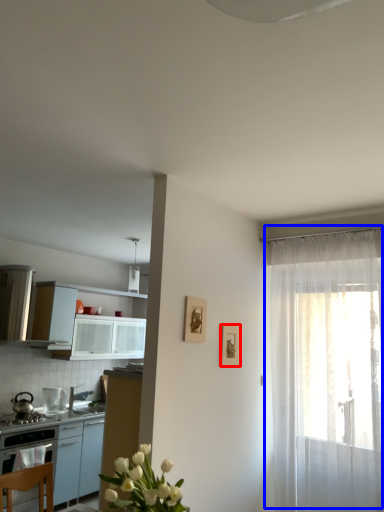
Question: Which point is closer to the camera, picture frame (highlighted by a red box) or curtain (highlighted by a blue box)?

Choices:
 (A) picture frame
 (B) curtain

Answer: (B)